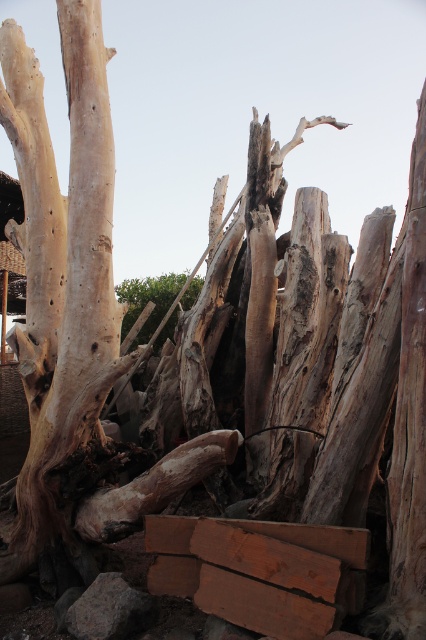
You are a park ranger who needs to place a 5 meter long safety barrier between the brown rough wood at lower center and the smooth brown wood at center. Is there enough space to place it?

The distance between the brown rough wood at lower center and the smooth brown wood at center is 7.09 meters, so yes, the 5 meter long safety barrier can be placed between them since the space is larger than the barrier.

You are an artist planning to paint a scene of the driftwood arrangement. You need to place a small bird on the smooth beige wood at left and a larger bird on the brown rough wood at lower center. Based on their positions, which bird will be closer to the left edge of your painting?

The small bird on the smooth beige wood at left will be closer to the left edge of the painting because the smooth beige wood at left is positioned to the left of the brown rough wood at lower center.

You are an artist planning to create a sculpture using the smooth beige wood at left and the brown rough wood at lower center. Which piece of wood can you use if you need a larger base for your sculpture?

The smooth beige wood at left is larger in size than the brown rough wood at lower center, so it can be used as the larger base for the sculpture.